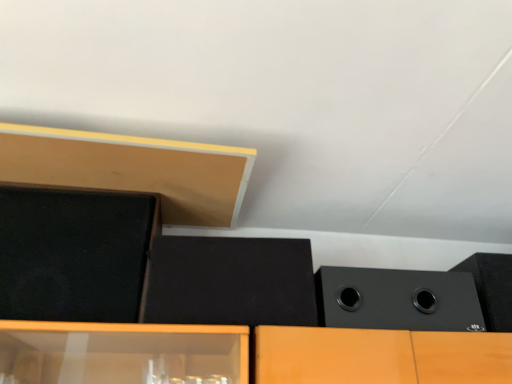
Question: Should I look upward or downward to see black matte speaker at upper right, which is counted as the fourth speaker, starting from the left?

Choices:
 (A) down
 (B) up

Answer: (A)

Question: Can you see black matte speaker at right, which is the 3th speaker in left-to-right order, touching black matte speaker at center, the second speaker from the left?

Choices:
 (A) no
 (B) yes

Answer: (A)

Question: From the image's perspective, does black matte speaker at right, arranged as the second speaker when viewed from the right, appear lower than black matte speaker at center, which appears as the third speaker when viewed from the right?

Choices:
 (A) no
 (B) yes

Answer: (B)

Question: Is black matte speaker at right, arranged as the second speaker when viewed from the right, at the right side of black matte speaker at center, the second speaker from the left?

Choices:
 (A) yes
 (B) no

Answer: (A)

Question: Is black matte speaker at right, arranged as the second speaker when viewed from the right, far from black matte speaker at center, which appears as the third speaker when viewed from the right?

Choices:
 (A) no
 (B) yes

Answer: (A)

Question: Is black matte speaker at right, which is the 3th speaker in left-to-right order, wider than black matte speaker at center, which appears as the third speaker when viewed from the right?

Choices:
 (A) no
 (B) yes

Answer: (B)

Question: Is black matte speaker at right, arranged as the second speaker when viewed from the right, positioned in front of black matte speaker at center, which appears as the third speaker when viewed from the right?

Choices:
 (A) no
 (B) yes

Answer: (A)

Question: Is black matte speaker at right, which is the 3th speaker in left-to-right order, oriented towards matte wood at upper left?

Choices:
 (A) yes
 (B) no

Answer: (B)

Question: Considering the relative positions of black matte speaker at right, which is the 3th speaker in left-to-right order, and matte wood at upper left in the image provided, is black matte speaker at right, which is the 3th speaker in left-to-right order, in front of matte wood at upper left?

Choices:
 (A) yes
 (B) no

Answer: (B)

Question: From a real-world perspective, is black matte speaker at right, arranged as the second speaker when viewed from the right, positioned under matte wood at upper left based on gravity?

Choices:
 (A) no
 (B) yes

Answer: (B)

Question: Is black matte speaker at right, arranged as the second speaker when viewed from the right, behind matte wood at upper left?

Choices:
 (A) no
 (B) yes

Answer: (B)

Question: Is black matte speaker at right, which is the 3th speaker in left-to-right order, facing away from matte wood at upper left?

Choices:
 (A) yes
 (B) no

Answer: (B)

Question: From the image's perspective, is black matte speaker at right, which is the 3th speaker in left-to-right order, above matte wood at upper left?

Choices:
 (A) no
 (B) yes

Answer: (A)

Question: Is black matte speaker at upper right, the first speaker when ordered from right to left, positioned behind black matte speaker at right, which is the 3th speaker in left-to-right order?

Choices:
 (A) yes
 (B) no

Answer: (A)